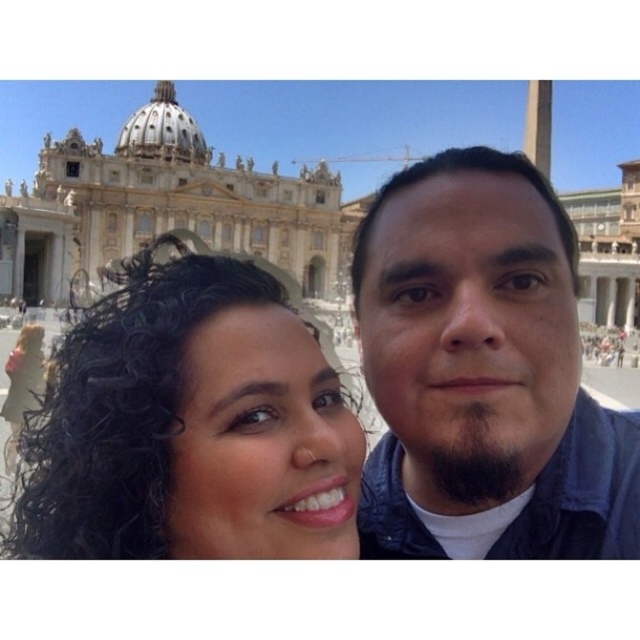
Does matte blue jacket at center have a lesser height compared to dark blue jacket at center?

Incorrect, matte blue jacket at center's height does not fall short of dark blue jacket at center's.

Is matte blue jacket at center behind dark blue jacket at center?

No, it is in front of dark blue jacket at center.

Is point (538, 340) closer to camera compared to point (544, 444)?

No, it is behind (544, 444).

The width and height of the screenshot is (640, 640). In order to click on matte blue jacket at center in this screenshot , I will do `click(483, 372)`.

Between matte blue jacket at center and dark curly hair at center, which one appears on the right side from the viewer's perspective?

From the viewer's perspective, matte blue jacket at center appears more on the right side.

Where is `matte blue jacket at center`? matte blue jacket at center is located at coordinates pos(483,372).

The width and height of the screenshot is (640, 640). Find the location of `matte blue jacket at center`. matte blue jacket at center is located at coordinates (483, 372).

Which of these two, dark blue jacket at center or dark curly hair at center, stands shorter?

With less height is dark curly hair at center.

Is dark blue jacket at center thinner than dark curly hair at center?

Yes.

The image size is (640, 640). Identify the location of dark blue jacket at center. [483, 372].

Locate an element on the screen. Image resolution: width=640 pixels, height=640 pixels. dark blue jacket at center is located at coordinates (483, 372).